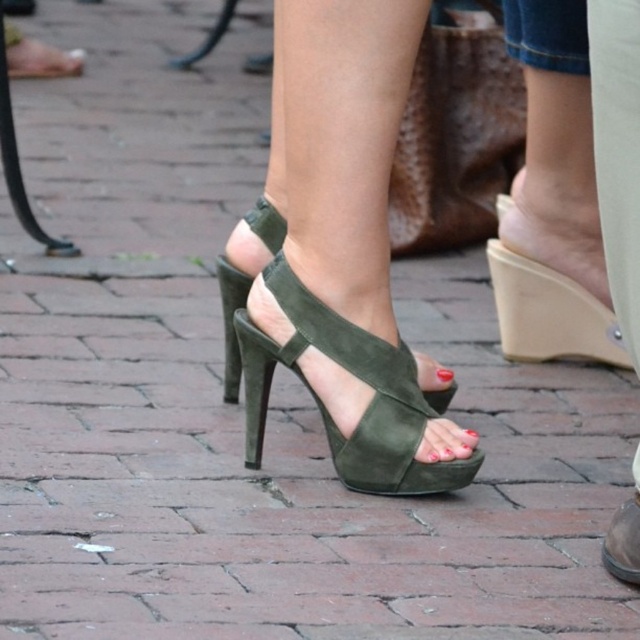
You are a photographer trying to capture the green suede toe at center without including the suede green sandal at center in the frame. Is this possible given their current positions?

The suede green sandal at center is positioned under the green suede toe at center, so it is possible to capture the green suede toe at center without the suede green sandal at center by focusing on the upper part of the toe where it extends beyond the sandal.